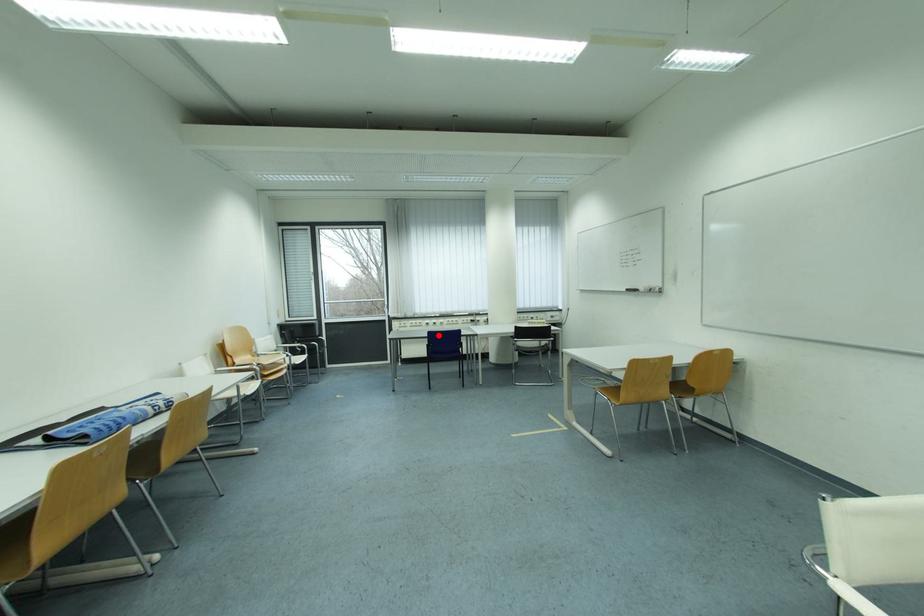
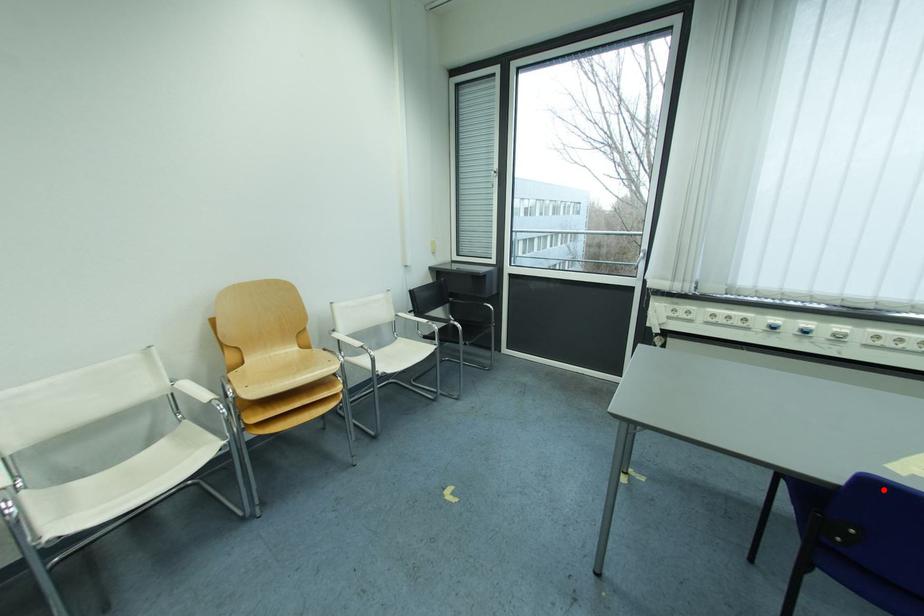
I am providing you with two images of the same scene from different viewpoints. A red point is marked on the first image and another point is marked on the second image. Are the points marked in image1 and image2 representing the same 3D position?

Yes